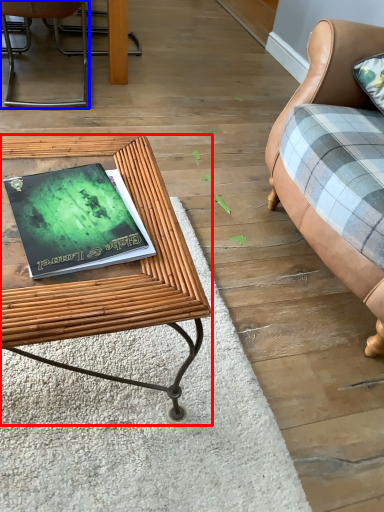
Question: Which object is further to the camera taking this photo, table (highlighted by a red box) or chair (highlighted by a blue box)?

Choices:
 (A) table
 (B) chair

Answer: (B)